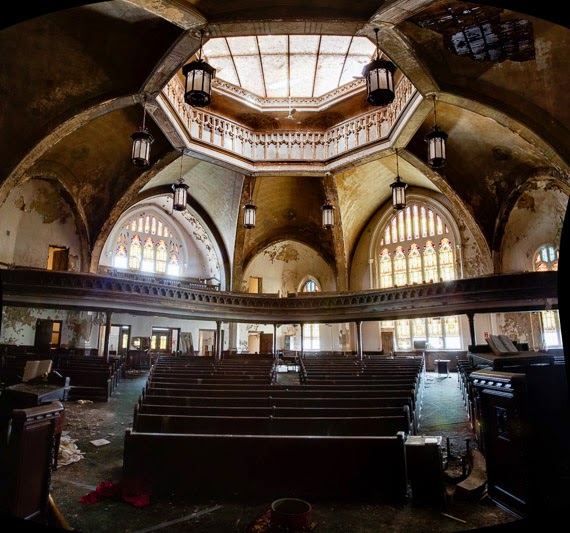
Identify the location of ceiling. The height and width of the screenshot is (533, 570). (291, 204).